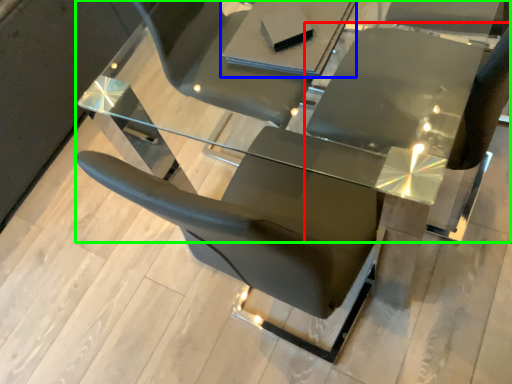
Question: Which object is positioned farthest from chair (highlighted by a red box)? Select from table (highlighted by a blue box) and table (highlighted by a green box).

Choices:
 (A) table
 (B) table

Answer: (A)